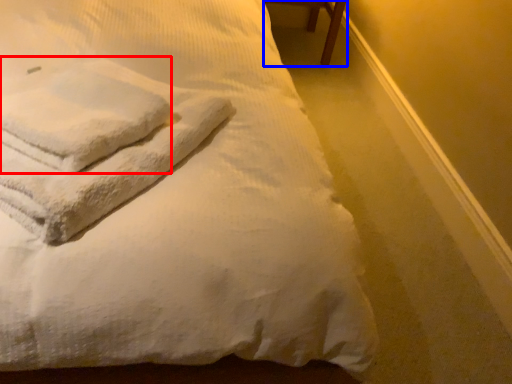
Question: Which point is closer to the camera, bath towel (highlighted by a red box) or furniture (highlighted by a blue box)?

Choices:
 (A) bath towel
 (B) furniture

Answer: (A)